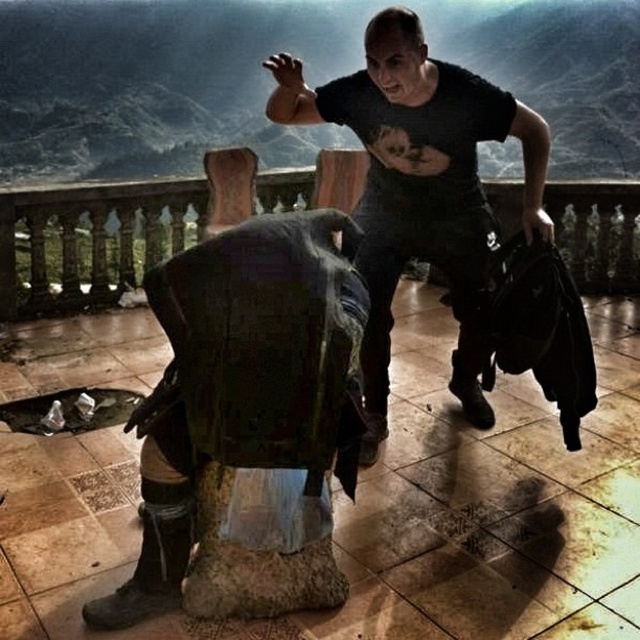
Question: Is brushed metal railing at upper center below polished stone balustrade at center?

Choices:
 (A) yes
 (B) no

Answer: (B)

Question: Can you confirm if brushed metal railing at upper center is bigger than polished stone balustrade at center?

Choices:
 (A) no
 (B) yes

Answer: (B)

Question: Which of the following is the closest to the observer?

Choices:
 (A) (472, 326)
 (B) (202, 216)
 (C) (273, 51)

Answer: (A)

Question: Can you confirm if brushed metal railing at upper center is positioned below black matte t-shirt at upper center?

Choices:
 (A) no
 (B) yes

Answer: (A)

Question: Which of the following is the closest to the observer?

Choices:
 (A) (61, 225)
 (B) (157, 49)

Answer: (A)

Question: Which point is closer to the camera?

Choices:
 (A) (456, 100)
 (B) (637, 24)

Answer: (A)